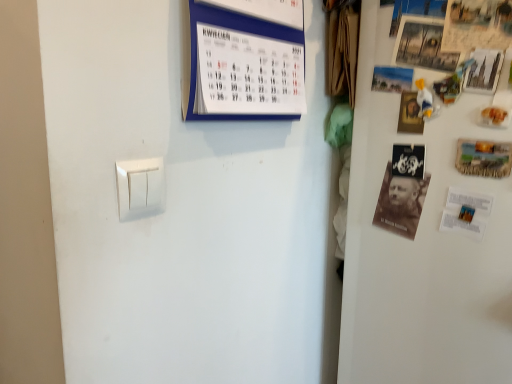
Question: Is wooden postcard at right completely or partially inside wooden framed poster at upper right, marked as the 2th poster in a left-to-right arrangement?

Choices:
 (A) yes
 (B) no

Answer: (B)

Question: From the image's perspective, is wooden framed poster at upper right, marked as the 2th poster in a left-to-right arrangement, under wooden postcard at right?

Choices:
 (A) yes
 (B) no

Answer: (B)

Question: Is wooden framed poster at upper right, marked as the 2th poster in a left-to-right arrangement, positioned with its back to wooden postcard at right?

Choices:
 (A) no
 (B) yes

Answer: (A)

Question: Is wooden framed poster at upper right, the 2th poster in the right-to-left sequence, taller than wooden postcard at right?

Choices:
 (A) no
 (B) yes

Answer: (B)

Question: Is there a large distance between wooden framed poster at upper right, marked as the 2th poster in a left-to-right arrangement, and wooden postcard at right?

Choices:
 (A) no
 (B) yes

Answer: (A)

Question: In the image, is wooden framed poster at upper right, the 2th poster in the right-to-left sequence, positioned in front of or behind wooden postcard at right?

Choices:
 (A) behind
 (B) front

Answer: (B)

Question: Do you think wooden framed poster at upper right, marked as the 2th poster in a left-to-right arrangement, is within wooden postcard at right, or outside of it?

Choices:
 (A) outside
 (B) inside

Answer: (A)

Question: Considering the positions of wooden framed poster at upper right, marked as the 2th poster in a left-to-right arrangement, and wooden postcard at right in the image, is wooden framed poster at upper right, marked as the 2th poster in a left-to-right arrangement, taller or shorter than wooden postcard at right?

Choices:
 (A) tall
 (B) short

Answer: (A)

Question: From a real-world perspective, is wooden framed poster at upper right, marked as the 2th poster in a left-to-right arrangement, positioned above or below wooden postcard at right?

Choices:
 (A) above
 (B) below

Answer: (A)

Question: From the image's perspective, is white plastic light switch at lower left located above or below white matte fridge at upper right?

Choices:
 (A) above
 (B) below

Answer: (A)

Question: Relative to white matte fridge at upper right, is white plastic light switch at lower left in front or behind?

Choices:
 (A) behind
 (B) front

Answer: (B)

Question: Based on their sizes in the image, would you say white plastic light switch at lower left is bigger or smaller than white matte fridge at upper right?

Choices:
 (A) big
 (B) small

Answer: (B)

Question: Is white plastic light switch at lower left taller or shorter than white matte fridge at upper right?

Choices:
 (A) tall
 (B) short

Answer: (B)

Question: In terms of width, does metallic silver poster at upper right, which is the first poster from right to left, look wider or thinner when compared to wooden framed poster at upper right, marked as the 2th poster in a left-to-right arrangement?

Choices:
 (A) thin
 (B) wide

Answer: (A)

Question: From the image's perspective, is metallic silver poster at upper right, the 3th poster in the left-to-right sequence, positioned above or below wooden framed poster at upper right, the 2th poster in the right-to-left sequence?

Choices:
 (A) above
 (B) below

Answer: (B)